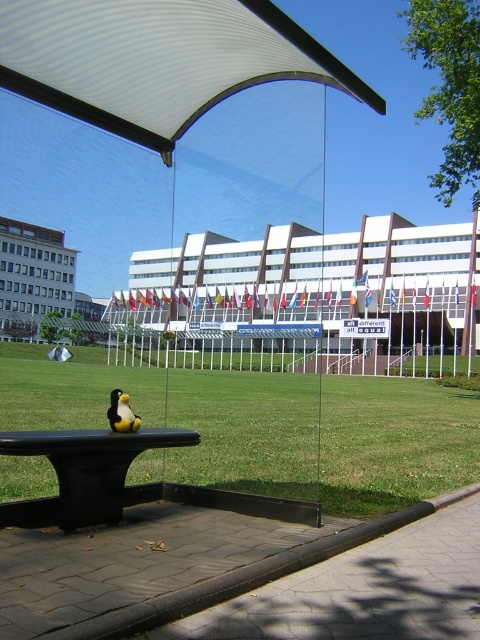
Is point (179, 122) more distant than point (124, 417)?

That is True.

Is point (297, 28) positioned in front of point (132, 422)?

That is True.

Where is `white fabric canopy at upper center`? This screenshot has height=640, width=480. white fabric canopy at upper center is located at coordinates (156, 60).

Can you confirm if white fabric canopy at upper center is shorter than black matte park bench at center?

No, white fabric canopy at upper center is not shorter than black matte park bench at center.

Does white fabric canopy at upper center have a smaller size compared to black matte park bench at center?

No.

The image size is (480, 640). Find the location of `white fabric canopy at upper center`. white fabric canopy at upper center is located at coordinates (156, 60).

Identify the location of white fabric canopy at upper center. (156, 60).

Is point (217, 372) in front of point (24, 17)?

No, it is behind (24, 17).

Between green grass at lower center and white fabric canopy at upper center, which one has less height?

white fabric canopy at upper center is shorter.

Does point (360, 480) come in front of point (31, 83)?

No, (360, 480) is further to viewer.

The height and width of the screenshot is (640, 480). Identify the location of green grass at lower center. (324, 436).